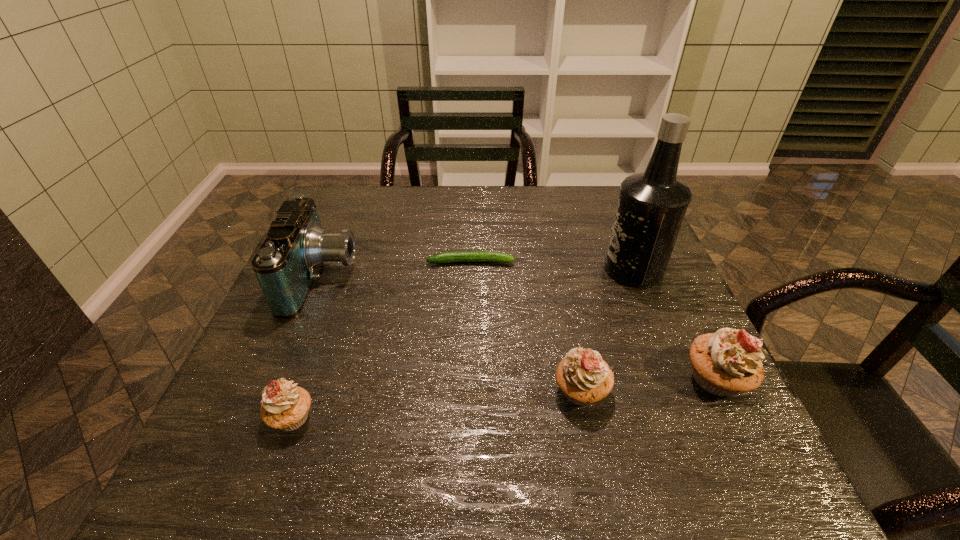
The image size is (960, 540). I want to click on liquor that is at the right edge, so click(651, 207).

Identify the location of object at the near left corner. (285, 406).

The image size is (960, 540). Identify the location of object at the near right corner. (725, 363).

I want to click on vacant position at the far edge of the desktop, so click(539, 212).

You are a GUI agent. You are given a task and a screenshot of the screen. Output one action in this format:
    pyautogui.click(x=<x>, y=<y>)
    Task: Click on the free space at the left edge
    The height and width of the screenshot is (540, 960).
    Given the screenshot: What is the action you would take?
    pyautogui.click(x=251, y=379)

In the image, there is a desktop. Where is `vacant space at the right edge`? The width and height of the screenshot is (960, 540). vacant space at the right edge is located at coordinates (636, 323).

This screenshot has width=960, height=540. In the image, there is a desktop. Identify the location of vacant space at the far right corner. (613, 208).

Where is `free spot between the tallest cupcake and the camcorder`? The image size is (960, 540). free spot between the tallest cupcake and the camcorder is located at coordinates (518, 328).

Where is `free area in between the leftmost cupcake and the camcorder`? The height and width of the screenshot is (540, 960). free area in between the leftmost cupcake and the camcorder is located at coordinates [x=306, y=348].

Where is `empty location between the shortest cupcake and the second cupcake from left to right`? empty location between the shortest cupcake and the second cupcake from left to right is located at coordinates (436, 404).